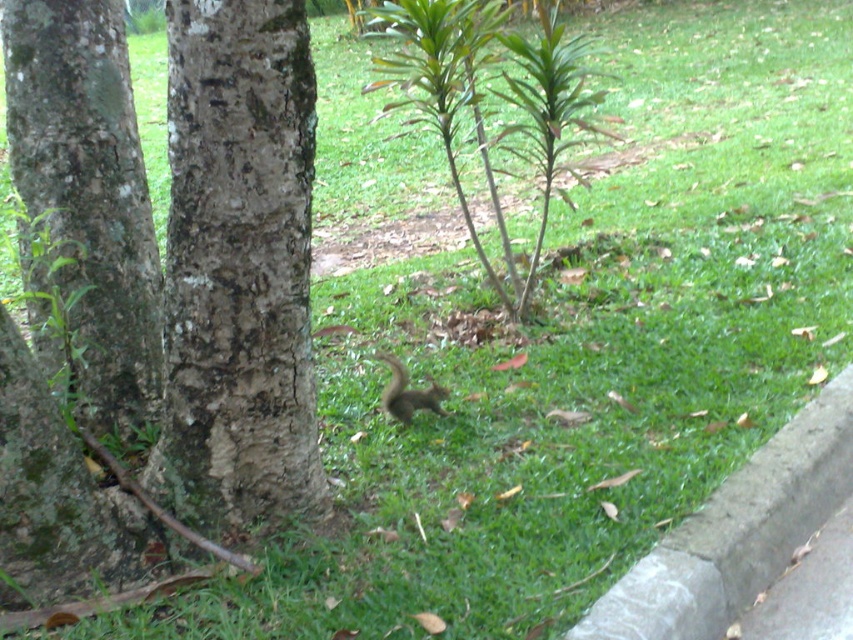
Question: Which object is positioned farthest from the gray fur squirrel at center?

Choices:
 (A) gray concrete curb at lower right
 (B) rough bark tree trunk at center

Answer: (A)

Question: Can you confirm if rough bark tree trunk at center is smaller than rough bark tree at left?

Choices:
 (A) yes
 (B) no

Answer: (B)

Question: From the image, what is the correct spatial relationship of rough bark tree at left in relation to gray concrete curb at lower right?

Choices:
 (A) right
 (B) left

Answer: (B)

Question: Considering the real-world distances, which object is farthest from the gray concrete curb at lower right?

Choices:
 (A) rough bark tree trunk at center
 (B) gray fur squirrel at center

Answer: (A)

Question: Considering the real-world distances, which object is farthest from the gray concrete curb at lower right?

Choices:
 (A) rough bark tree trunk at center
 (B) rough bark tree at left

Answer: (B)

Question: Is rough bark tree trunk at center further to the viewer compared to rough bark tree at left?

Choices:
 (A) no
 (B) yes

Answer: (A)